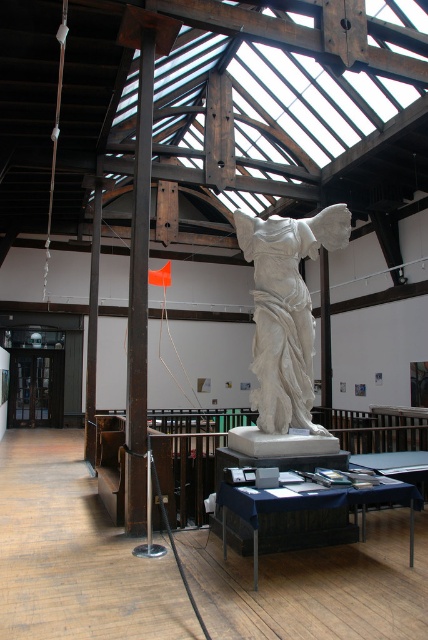
You are an art curator planning to install a new light fixture above the white marble statue at center and the orange fabric flag at center. According to the scene description, which object is positioned lower and would require the light fixture to be placed higher to avoid obstruction?

The white marble statue at center is located below the orange fabric flag at center, so the light fixture should be placed higher than the orange fabric flag at center to avoid obstruction.

Based on the photo, you are a visitor in the gallery and want to take a photo of both the white marble statue at center and the orange fabric flag at center. If your camera has a maximum focus range of 8 meters, will you be able to capture both objects in focus at the same time?

The white marble statue at center is 8.11 meters away from the orange fabric flag at center. Since the camera can only focus up to 8 meters, the distance between them exceeds the camera range, so you cannot capture both in focus simultaneously.